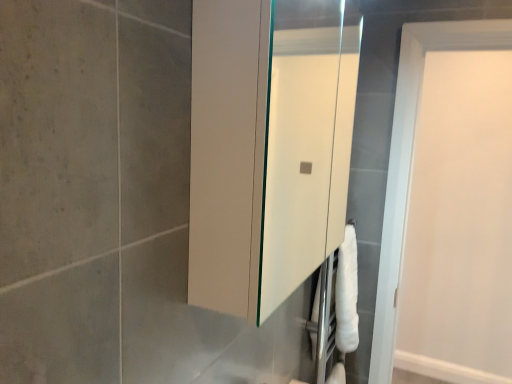
Measure the distance between point (335,368) and camera.

Point (335,368) is 1.86 meters away from camera.

What do you see at coordinates (337, 374) in the screenshot?
I see `white matte toilet paper at lower right` at bounding box center [337, 374].

Describe the element at coordinates (268, 147) in the screenshot. I see `white glossy medicine cabinet at center` at that location.

This screenshot has height=384, width=512. Identify the location of white matte toilet paper at lower right. (337, 374).

Between white glossy medicine cabinet at center and white matte toilet paper at lower right, which one has more height?

Standing taller between the two is white glossy medicine cabinet at center.

Can we say white glossy medicine cabinet at center lies outside white matte toilet paper at lower right?

That's correct, white glossy medicine cabinet at center is outside of white matte toilet paper at lower right.

Is white glossy medicine cabinet at center touching white matte toilet paper at lower right?

white glossy medicine cabinet at center and white matte toilet paper at lower right are clearly separated.

This screenshot has height=384, width=512. What are the coordinates of `medicine cabinet above the white matte toilet paper at lower right (from the image's perspective)` in the screenshot? It's located at (268, 147).

Could you tell me if white matte door at upper right is facing white glossy medicine cabinet at center?

No, white matte door at upper right does not turn towards white glossy medicine cabinet at center.

Which object is further away from the camera, white matte door at upper right or white glossy medicine cabinet at center?

white matte door at upper right is behind.

Considering the relative sizes of white matte door at upper right and white glossy medicine cabinet at center in the image provided, is white matte door at upper right wider than white glossy medicine cabinet at center?

Incorrect, the width of white matte door at upper right does not surpass that of white glossy medicine cabinet at center.

From the image's perspective, relative to white matte door at upper right, is white matte toilet paper at lower right above or below?

white matte toilet paper at lower right is below white matte door at upper right.

Does point (340, 379) appear closer or farther from the camera than point (411, 146)?

Point (340, 379) is farther from the camera than point (411, 146).

Is white matte toilet paper at lower right completely or partially outside of white matte door at upper right?

Yes, white matte toilet paper at lower right is not within white matte door at upper right.

From the image's perspective, is white glossy medicine cabinet at center located above or below white matte door at upper right?

Based on their image positions, white glossy medicine cabinet at center is located above white matte door at upper right.

Considering the points (269, 109) and (413, 130), which point is behind, point (269, 109) or point (413, 130)?

Point (413, 130)

Can you confirm if white glossy medicine cabinet at center is wider than white matte door at upper right?

Yes.

Locate an element on the screen. door below the white glossy medicine cabinet at center (from a real-world perspective) is located at coordinates (411, 161).

From the image's perspective, is white matte door at upper right above or below white matte toilet paper at lower right?

white matte door at upper right is situated higher than white matte toilet paper at lower right in the image.

Which object is positioned more to the right, white matte door at upper right or white matte toilet paper at lower right?

white matte door at upper right.

From a real-world perspective, which object stands above the other?

white matte door at upper right.

Which of these two, white matte door at upper right or white matte toilet paper at lower right, is thinner?

With smaller width is white matte toilet paper at lower right.

From the image's perspective, is white matte toilet paper at lower right beneath white glossy medicine cabinet at center?

Yes, from the image's perspective, white matte toilet paper at lower right is beneath white glossy medicine cabinet at center.

From the picture: From a real-world perspective, is white matte toilet paper at lower right positioned above or below white glossy medicine cabinet at center?

Clearly, from a real-world perspective, white matte toilet paper at lower right is below white glossy medicine cabinet at center.

Is white glossy medicine cabinet at center a part of white matte toilet paper at lower right?

That's incorrect, white glossy medicine cabinet at center is not inside white matte toilet paper at lower right.

Based on the photo, considering the sizes of white matte toilet paper at lower right and white glossy medicine cabinet at center in the image, is white matte toilet paper at lower right wider or thinner than white glossy medicine cabinet at center?

white matte toilet paper at lower right is thinner than white glossy medicine cabinet at center.

Locate an element on the screen. The height and width of the screenshot is (384, 512). toilet paper below the white glossy medicine cabinet at center (from a real-world perspective) is located at coordinates (337, 374).

This screenshot has height=384, width=512. Identify the location of medicine cabinet that appears above the white matte door at upper right (from the image's perspective). (268, 147).

Looking at the image, which one is located further to white matte door at upper right, white matte toilet paper at lower right or white glossy medicine cabinet at center?

white glossy medicine cabinet at center lies further to white matte door at upper right than the other object.

Estimate the real-world distances between objects in this image. Which object is further from white matte door at upper right, white glossy medicine cabinet at center or white matte toilet paper at lower right?

white glossy medicine cabinet at center.

Estimate the real-world distances between objects in this image. Which object is closer to white matte toilet paper at lower right, white matte door at upper right or white glossy medicine cabinet at center?

white matte door at upper right is closer to white matte toilet paper at lower right.

From the image, which object appears to be nearer to white matte toilet paper at lower right, white glossy medicine cabinet at center or white matte door at upper right?

The object closer to white matte toilet paper at lower right is white matte door at upper right.

Based on their spatial positions, is white matte toilet paper at lower right or white matte door at upper right closer to white glossy medicine cabinet at center?

Among the two, white matte door at upper right is located nearer to white glossy medicine cabinet at center.

Based on their spatial positions, is white matte door at upper right or white matte toilet paper at lower right closer to white glossy medicine cabinet at center?

The object closer to white glossy medicine cabinet at center is white matte door at upper right.

Identify the location of door between white glossy medicine cabinet at center and white matte toilet paper at lower right from top to bottom. This screenshot has width=512, height=384. (411, 161).